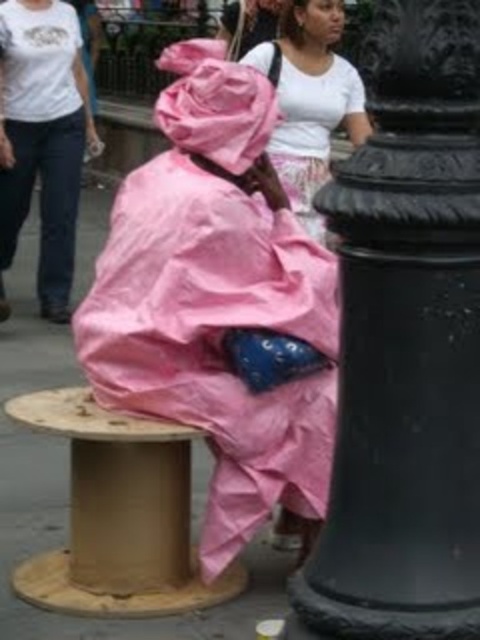
Measure the distance from pink plastic bag at center to cardboard spool at center.

A distance of 18.02 inches exists between pink plastic bag at center and cardboard spool at center.

Does pink plastic bag at center have a larger size compared to cardboard spool at center?

Indeed, pink plastic bag at center has a larger size compared to cardboard spool at center.

The height and width of the screenshot is (640, 480). Identify the location of pink plastic bag at center. (219, 301).

Measure the distance between pink plastic bag at center and pink plastic bag at lower left.

They are 3.69 meters apart.

Can you confirm if pink plastic bag at center is bigger than pink plastic bag at lower left?

Actually, pink plastic bag at center might be smaller than pink plastic bag at lower left.

Measure the distance between pink plastic bag at center and camera.

The distance of pink plastic bag at center from camera is 3.78 meters.

Locate an element on the screen. pink plastic bag at center is located at coordinates (219, 301).

Who is positioned more to the right, black cast iron post at right or pink plastic bag at center?

black cast iron post at right is more to the right.

Which is above, black cast iron post at right or pink plastic bag at center?

pink plastic bag at center is higher up.

The height and width of the screenshot is (640, 480). I want to click on black cast iron post at right, so click(406, 346).

The width and height of the screenshot is (480, 640). I want to click on black cast iron post at right, so click(406, 346).